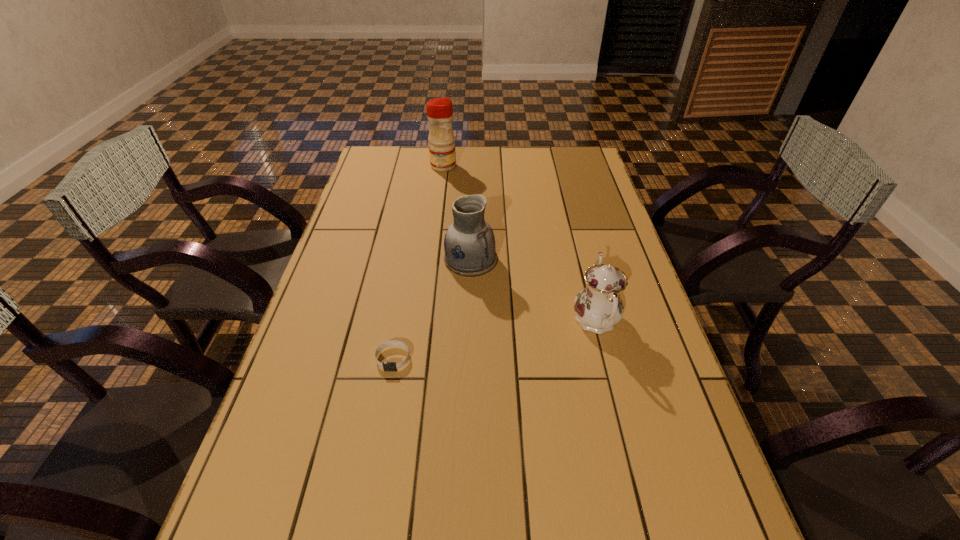
Image resolution: width=960 pixels, height=540 pixels. Find the location of `object located in the right edge section of the desktop`. object located in the right edge section of the desktop is located at coordinates (598, 307).

The height and width of the screenshot is (540, 960). Find the location of `vacant space at the far edge of the desktop`. vacant space at the far edge of the desktop is located at coordinates (407, 170).

In the image, there is a desktop. In order to click on free region at the left edge in this screenshot , I will do `click(331, 451)`.

Where is `vacant space at the right edge of the desktop`? This screenshot has width=960, height=540. vacant space at the right edge of the desktop is located at coordinates point(608,198).

Image resolution: width=960 pixels, height=540 pixels. I want to click on vacant space at the far right corner of the desktop, so click(x=575, y=148).

The width and height of the screenshot is (960, 540). What are the coordinates of `vacant region between the rightmost object and the second farthest object` in the screenshot? It's located at (534, 291).

You are a GUI agent. You are given a task and a screenshot of the screen. Output one action in this format:
    pyautogui.click(x=<x>, y=<y>)
    Task: Click on the free spot between the chinaware and the pottery
    The width and height of the screenshot is (960, 540).
    Given the screenshot: What is the action you would take?
    pyautogui.click(x=534, y=291)

Find the location of a particular element. blank region between the chinaware and the shortest object is located at coordinates point(494,340).

Where is `free space between the wristband and the condiment`? free space between the wristband and the condiment is located at coordinates (419, 262).

Locate an element on the screen. The image size is (960, 540). free space between the tallest object and the rightmost object is located at coordinates (519, 244).